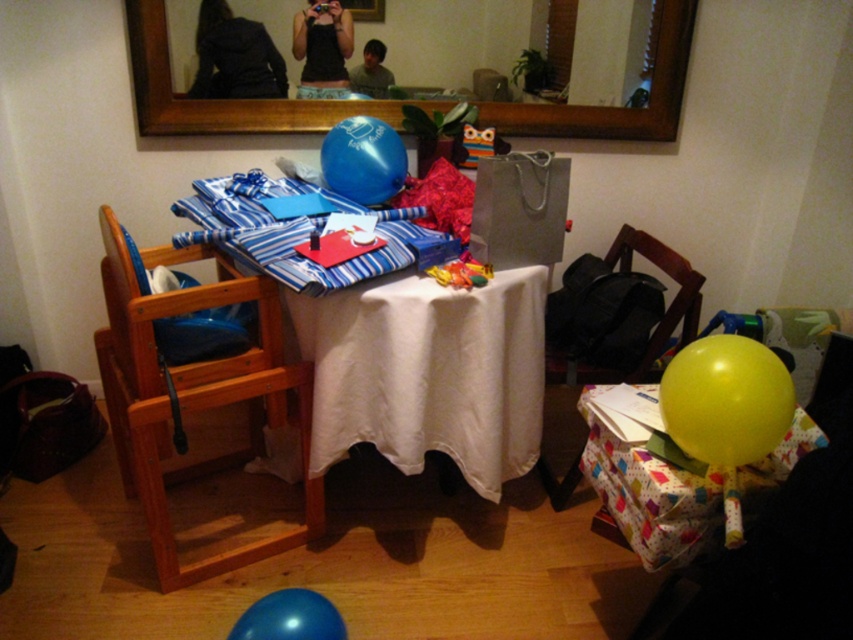
Who is taller, wooden frame mirror at upper center or yellow rubber balloon at lower right?

wooden frame mirror at upper center

Does wooden frame mirror at upper center have a greater height compared to yellow rubber balloon at lower right?

Yes.

Which is in front, point (358, 108) or point (734, 436)?

Point (734, 436) is in front.

Locate an element on the screen. This screenshot has width=853, height=640. wooden frame mirror at upper center is located at coordinates (210, 100).

Based on the photo, between blue rubber balloon at upper center and blue rubber balloon at lower center, which one appears on the left side from the viewer's perspective?

Positioned to the left is blue rubber balloon at lower center.

Is blue rubber balloon at upper center positioned before blue rubber balloon at lower center?

No, it is not.

Does point (360, 204) lie behind point (276, 612)?

Yes, point (360, 204) is farther from viewer.

What are the coordinates of `blue rubber balloon at upper center` in the screenshot? It's located at (363, 160).

Can you confirm if blue rubber balloon at lower center is positioned above matte green shirt at center?

No.

In the scene shown: Is blue rubber balloon at lower center thinner than matte green shirt at center?

No.

Locate an element on the screen. The height and width of the screenshot is (640, 853). blue rubber balloon at lower center is located at coordinates (289, 618).